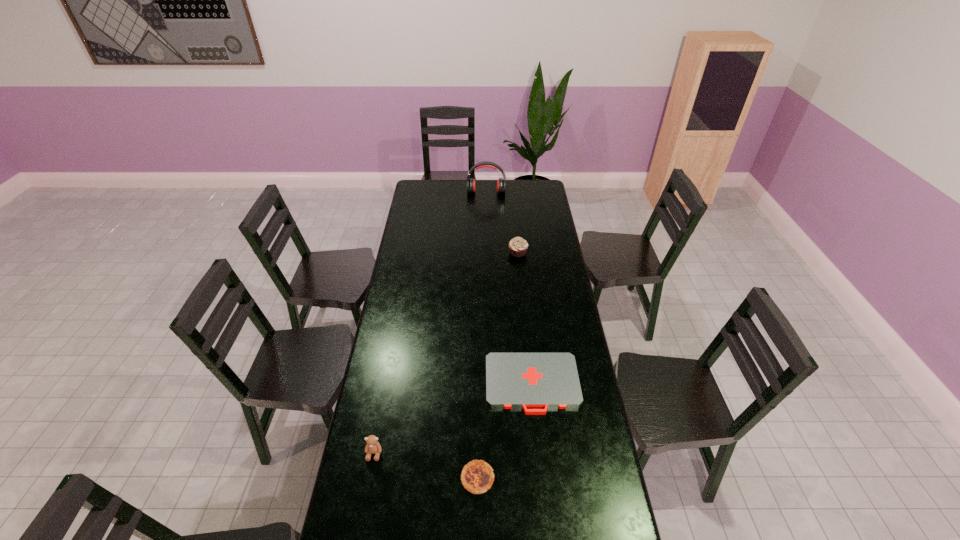
Find the location of `free space that is in between the fourth farthest object and the muffin`. free space that is in between the fourth farthest object and the muffin is located at coordinates (446, 353).

Image resolution: width=960 pixels, height=540 pixels. I want to click on free space between the second nearest object and the nearest object, so click(426, 465).

The height and width of the screenshot is (540, 960). I want to click on vacant region between the farthest object and the teddy bear, so click(x=430, y=322).

Where is `empty space that is in between the second farthest object and the tallest object`? Image resolution: width=960 pixels, height=540 pixels. empty space that is in between the second farthest object and the tallest object is located at coordinates (502, 222).

Locate an element on the screen. The image size is (960, 540). free spot between the farthest object and the third farthest object is located at coordinates (509, 288).

At what (x,y) coordinates should I click in order to perform the action: click on unoccupied position between the leftmost object and the nearest object. Please return your answer as a coordinate pair (x, y). The width and height of the screenshot is (960, 540). Looking at the image, I should click on (426, 465).

At what (x,y) coordinates should I click in order to perform the action: click on free space between the muffin and the farthest object. Please return your answer as a coordinate pair (x, y). This screenshot has width=960, height=540. Looking at the image, I should click on (502, 222).

Find the location of `vacant area between the teddy bear and the tallest object`. vacant area between the teddy bear and the tallest object is located at coordinates (430, 322).

Locate an element on the screen. empty space that is in between the tallest object and the quiche is located at coordinates (482, 335).

You are a GUI agent. You are given a task and a screenshot of the screen. Output one action in this format:
    pyautogui.click(x=<x>, y=<y>)
    Task: Click on the vacant space in between the teddy bear and the farthest object
    The height and width of the screenshot is (540, 960).
    Given the screenshot: What is the action you would take?
    pyautogui.click(x=430, y=322)